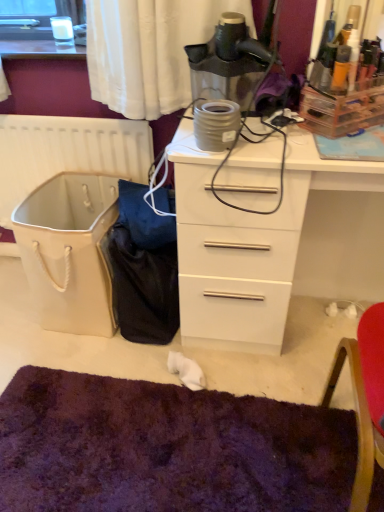
Image resolution: width=384 pixels, height=512 pixels. Find the location of `white glossy chest of drawers at center`. white glossy chest of drawers at center is located at coordinates (248, 241).

Measure the distance between white plastic chair at right and camera.

34.06 inches.

What do you see at coordinates (167, 448) in the screenshot?
I see `purple shaggy mat at lower center` at bounding box center [167, 448].

Image resolution: width=384 pixels, height=512 pixels. What are the coordinates of `white glossy chest of drawers at center` in the screenshot? It's located at (248, 241).

Is white glossy chest of drawers at center far away from white plastic radiator at left?

No, white glossy chest of drawers at center is not far away from white plastic radiator at left.

Measure the distance between white glossy chest of drawers at center and white plastic radiator at left.

They are 24.33 inches apart.

What's the angular difference between white glossy chest of drawers at center and white plastic radiator at left's facing directions?

The angular difference between white glossy chest of drawers at center and white plastic radiator at left is 0.502 degrees.

From the image's perspective, which is below, white glossy chest of drawers at center or white plastic radiator at left?

From the image's view, white glossy chest of drawers at center is below.

From a real-world perspective, who is located lower, white plastic radiator at left or white glossy chest of drawers at center?

white glossy chest of drawers at center.

Considering the relative sizes of white plastic radiator at left and white glossy chest of drawers at center in the image provided, is white plastic radiator at left taller than white glossy chest of drawers at center?

No.

Between white plastic radiator at left and white glossy chest of drawers at center, which one is positioned behind?

white plastic radiator at left is further away from the camera.

Between white plastic radiator at left and white glossy chest of drawers at center, which one appears on the left side from the viewer's perspective?

white plastic radiator at left is more to the left.

Does white plastic chair at right come behind matte black hairdryer at upper center?

No, white plastic chair at right is closer to the viewer.

Between white plastic chair at right and matte black hairdryer at upper center, which one appears on the left side from the viewer's perspective?

From the viewer's perspective, matte black hairdryer at upper center appears more on the left side.

Which of these two, white plastic chair at right or matte black hairdryer at upper center, stands shorter?

matte black hairdryer at upper center is shorter.

Looking at this image, considering the sizes of objects white plastic chair at right and white glossy chest of drawers at center in the image provided, who is taller, white plastic chair at right or white glossy chest of drawers at center?

white plastic chair at right is taller.

From a real-world perspective, which object stands above the other?

white plastic chair at right, from a real-world perspective.

Choose the correct answer: Is white plastic chair at right inside white glossy chest of drawers at center or outside it?

white plastic chair at right is not enclosed by white glossy chest of drawers at center.

Consider the image. From the image's perspective, which is below, white plastic chair at right or white glossy chest of drawers at center?

white plastic chair at right is shown below in the image.

Considering the sizes of objects white plastic radiator at left and white plastic chair at right in the image provided, who is wider, white plastic radiator at left or white plastic chair at right?

white plastic chair at right is wider.

Is white plastic radiator at left next to white plastic chair at right and touching it?

No, white plastic radiator at left is not with white plastic chair at right.

Does white plastic radiator at left have a greater height compared to white plastic chair at right?

In fact, white plastic radiator at left may be shorter than white plastic chair at right.

Between point (137, 147) and point (358, 429), which one is positioned behind?

The point (137, 147) is farther.

Considering the relative sizes of white plastic radiator at left and matte black hairdryer at upper center in the image provided, is white plastic radiator at left bigger than matte black hairdryer at upper center?

Yes.

Which is behind, point (34, 117) or point (238, 32)?

The point (34, 117) is behind.

Which object is closer to the camera, white plastic radiator at left or matte black hairdryer at upper center?

matte black hairdryer at upper center is more forward.

From the image's perspective, is white plastic radiator at left under matte black hairdryer at upper center?

Yes, from the image's perspective, white plastic radiator at left is beneath matte black hairdryer at upper center.

Is white glossy chest of drawers at center turned away from matte black hairdryer at upper center?

white glossy chest of drawers at center is not turned away from matte black hairdryer at upper center.

Does point (271, 266) come closer to viewer compared to point (204, 60)?

No, it is not.

Locate an element on the screen. appliance above the white glossy chest of drawers at center (from a real-world perspective) is located at coordinates (232, 61).

Can you confirm if white glossy chest of drawers at center is thinner than matte black hairdryer at upper center?

Incorrect, the width of white glossy chest of drawers at center is not less than that of matte black hairdryer at upper center.

Where is `chest of drawers in front of the white plastic radiator at left`? This screenshot has height=512, width=384. chest of drawers in front of the white plastic radiator at left is located at coordinates (248, 241).

This screenshot has height=512, width=384. What are the coordinates of `radiator above the white glossy chest of drawers at center (from a real-world perspective)` in the screenshot? It's located at [x=67, y=152].

Which object lies nearer to the anchor point white plastic radiator at left, white glossy chest of drawers at center or purple shaggy mat at lower center?

The object closer to white plastic radiator at left is white glossy chest of drawers at center.

Estimate the real-world distances between objects in this image. Which object is further from white plastic radiator at left, white plastic chair at right or white glossy chest of drawers at center?

white plastic chair at right is positioned further to the anchor white plastic radiator at left.

Looking at the image, which one is located closer to white plastic radiator at left, matte black hairdryer at upper center or white plastic chair at right?

The object closer to white plastic radiator at left is matte black hairdryer at upper center.

Considering their positions, is matte black hairdryer at upper center positioned closer to white plastic radiator at left than purple shaggy mat at lower center?

matte black hairdryer at upper center is positioned closer to the anchor white plastic radiator at left.

In the scene shown: From the image, which object appears to be farther from matte black hairdryer at upper center, white plastic chair at right or purple shaggy mat at lower center?

purple shaggy mat at lower center is further to matte black hairdryer at upper center.

Based on their spatial positions, is matte black hairdryer at upper center or white plastic radiator at left further from white glossy chest of drawers at center?

white plastic radiator at left lies further to white glossy chest of drawers at center than the other object.

Consider the image. Which object lies further to the anchor point purple shaggy mat at lower center, white glossy chest of drawers at center or white plastic radiator at left?

white plastic radiator at left is further to purple shaggy mat at lower center.

Based on their spatial positions, is white plastic radiator at left or matte black hairdryer at upper center further from white glossy chest of drawers at center?

Among the two, white plastic radiator at left is located further to white glossy chest of drawers at center.

Locate an element on the screen. This screenshot has height=512, width=384. chest of drawers between matte black hairdryer at upper center and white plastic chair at right in the up-down direction is located at coordinates (248, 241).

You are a GUI agent. You are given a task and a screenshot of the screen. Output one action in this format:
    pyautogui.click(x=<x>, y=<y>)
    Task: Click on the furniture between white glossy chest of drawers at center and purple shaggy mat at lower center in the up-down direction
    The height and width of the screenshot is (512, 384).
    Given the screenshot: What is the action you would take?
    364,397

The image size is (384, 512). I want to click on chest of drawers between white plastic radiator at left and purple shaggy mat at lower center in the vertical direction, so click(248, 241).

Identify the location of appliance between white plastic radiator at left and white glossy chest of drawers at center. This screenshot has width=384, height=512. (232, 61).